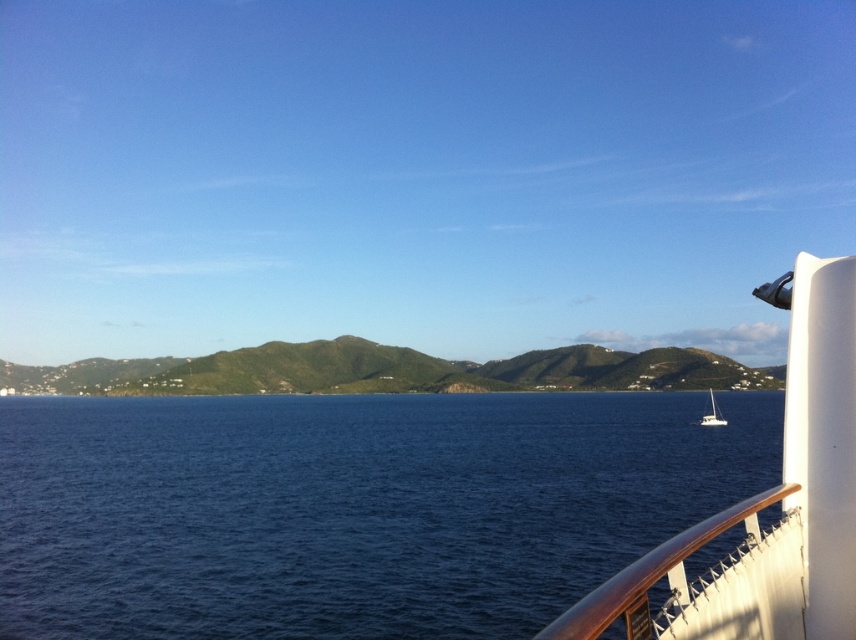
You are standing on the ship deck and want to locate two specific points marked on the railing. The first point is at coordinate point(670, 628) and the second is at point(706, 522). Which point is nearer to you?

Point(670, 628) is closer to the viewer than point(706, 522).